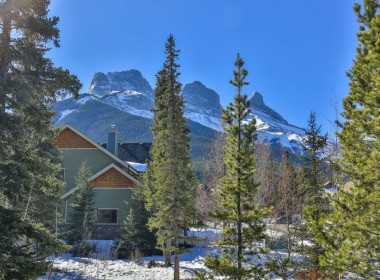
Find the location of a particular element. This screenshot has height=280, width=380. chimney is located at coordinates (115, 146).